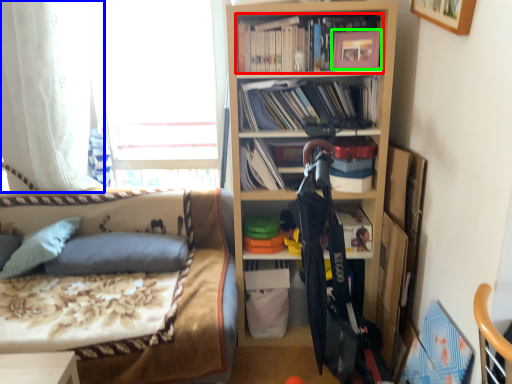
Question: Which object is the closest to the book (highlighted by a red box)? Choose among these: curtain (highlighted by a blue box) or picture frame (highlighted by a green box).

Choices:
 (A) curtain
 (B) picture frame

Answer: (B)